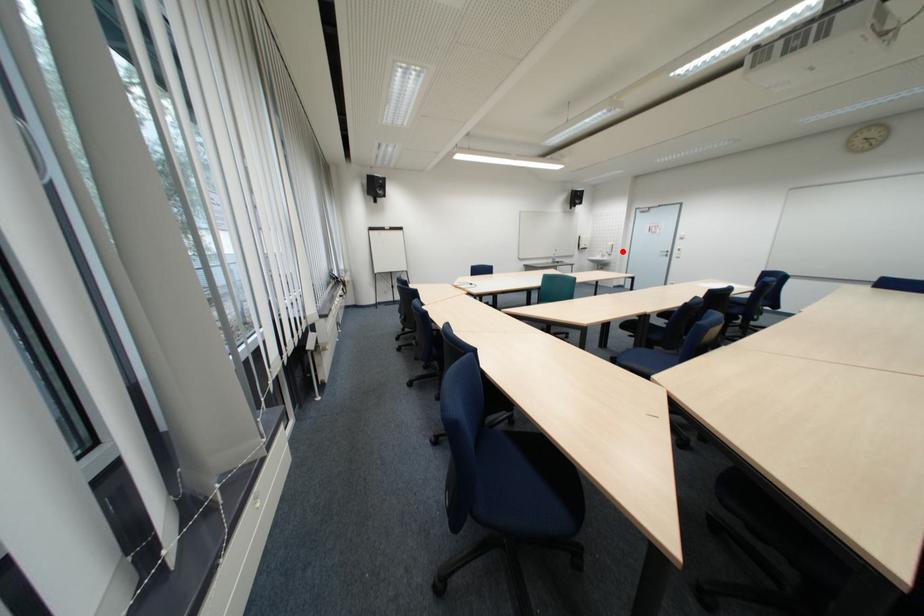
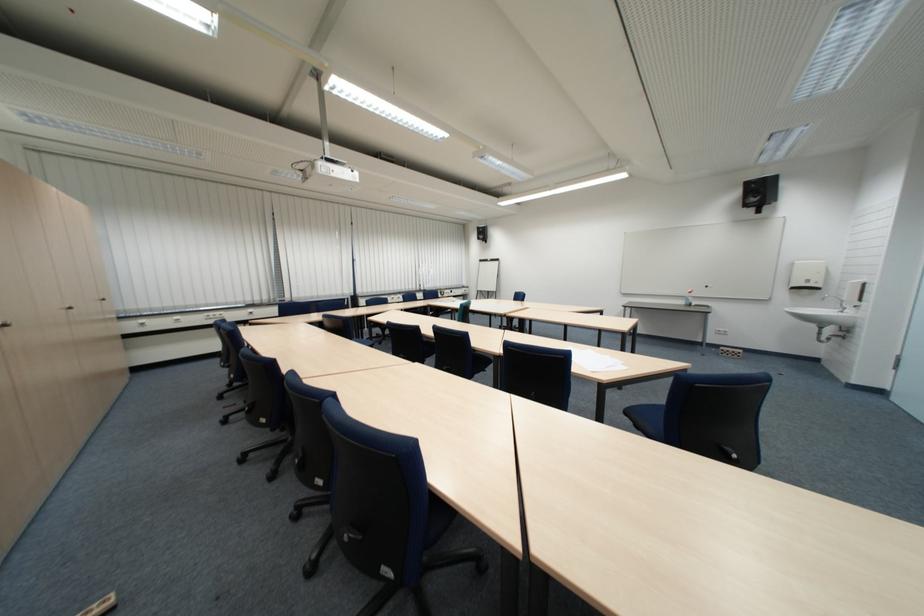
Question: I am providing you with two images of the same scene from different viewpoints. Given a red point in image1, look at the same physical point in image2. Is it:

Choices:
 (A) Closer to the viewpoint
 (B) Farther from the viewpoint

Answer: (B)